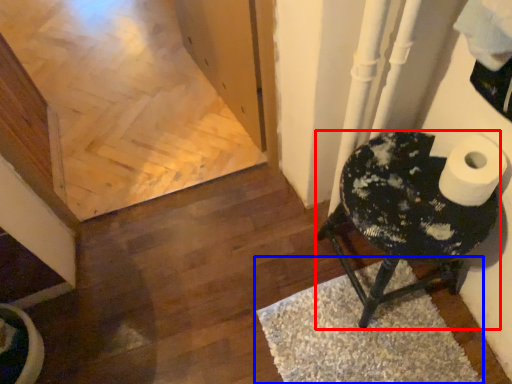
Question: Among these objects, which one is nearest to the camera, furniture (highlighted by a red box) or doormat (highlighted by a blue box)?

Choices:
 (A) furniture
 (B) doormat

Answer: (A)